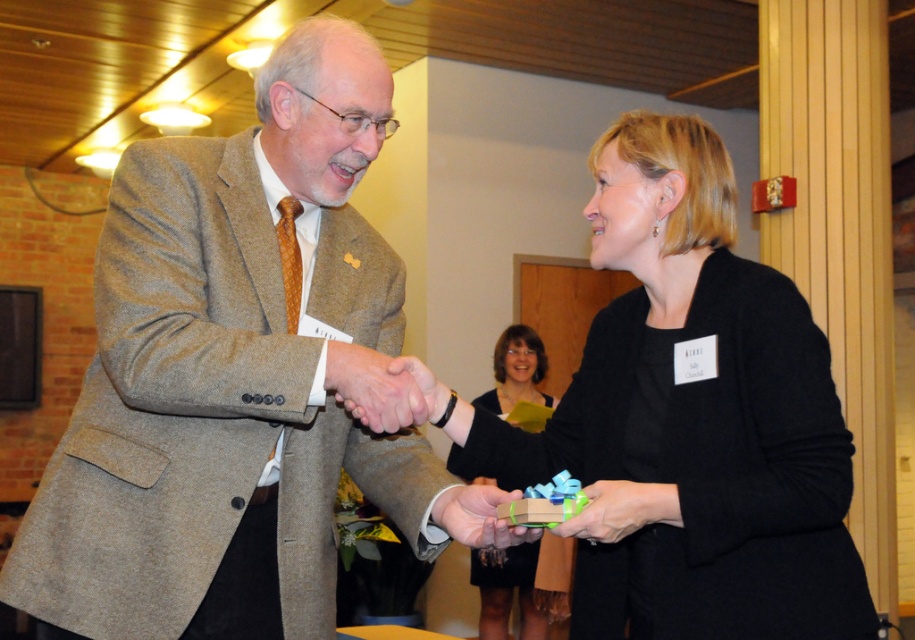
You are organizing a charity event and need to decide which item to place on the main table. The black satin dress at center and the matte green gift at center are both available. Based on their sizes, which one should you choose if you want the larger item on the table?

The black satin dress at center is bigger than the matte green gift at center, so you should choose the black satin dress at center for the main table.

You are a photographer at the event and want to capture a closeup shot of both the matte brown hand at center and the green matte gift box at center. Which object should you focus on first if you want to ensure both are in focus without adjusting the camera settings?

The matte brown hand at center is smaller in size compared to the green matte gift box at center, so focusing on the larger green matte gift box at center first would help ensure both are in focus as the depth of field is more forgiving for larger objects.